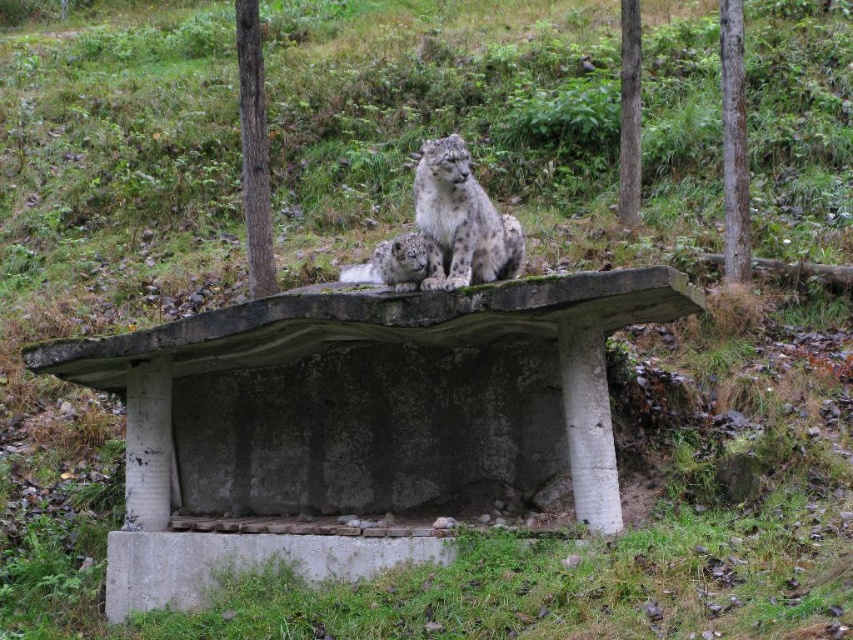
Does smooth brown tree trunk at center appear on the left side of smooth bark tree at right?

Correct, you'll find smooth brown tree trunk at center to the left of smooth bark tree at right.

Is the position of smooth brown tree trunk at center less distant than that of smooth bark tree at right?

Yes, smooth brown tree trunk at center is closer to the viewer.

Locate an element on the screen. Image resolution: width=853 pixels, height=640 pixels. smooth brown tree trunk at center is located at coordinates (254, 148).

Between white fur snow leopard at center and smooth brown tree trunk at center, which one is positioned lower?

white fur snow leopard at center is below.

Is white fur snow leopard at center in front of smooth brown tree trunk at center?

Yes, white fur snow leopard at center is in front of smooth brown tree trunk at center.

Is point (461, 138) positioned after point (260, 109)?

No, (461, 138) is closer to viewer.

The width and height of the screenshot is (853, 640). In order to click on white fur snow leopard at center in this screenshot , I will do `click(461, 220)`.

Can you confirm if white fur snow leopard at center is positioned below smooth bark tree at right?

Yes.

Is point (438, 269) farther from viewer compared to point (621, 13)?

No.

Which is in front, point (508, 269) or point (624, 177)?

Point (508, 269)

Where is `white fur snow leopard at center`? This screenshot has width=853, height=640. white fur snow leopard at center is located at coordinates (461, 220).